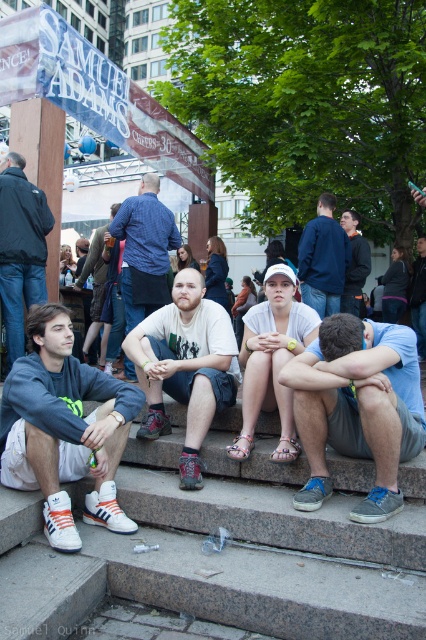
Consider the image. Which is above, white matte shirt at center or blue denim jeans at center?

blue denim jeans at center is higher up.

Measure the distance from white matte shirt at center to blue denim jeans at center.

white matte shirt at center and blue denim jeans at center are 5.43 meters apart from each other.

Is point (255, 353) positioned before point (97, 280)?

Yes, it is.

The image size is (426, 640). What are the coordinates of `white matte shirt at center` in the screenshot? It's located at (271, 360).

Is blue denim shirt at center smaller than blue denim jeans at center?

Incorrect, blue denim shirt at center is not smaller in size than blue denim jeans at center.

Between blue denim shirt at center and blue denim jeans at center, which one has less height?

blue denim jeans at center

At what (x,y) coordinates should I click in order to perform the action: click on blue denim shirt at center. Please return your answer as a coordinate pair (x, y). The image size is (426, 640). Looking at the image, I should click on (144, 250).

Who is taller, blue fabric shirt at lower right or white cotton t-shirt at center?

With more height is white cotton t-shirt at center.

Who is more distant from viewer, (x=371, y=332) or (x=172, y=340)?

Point (x=172, y=340)

Locate an element on the screen. blue fabric shirt at lower right is located at coordinates (357, 406).